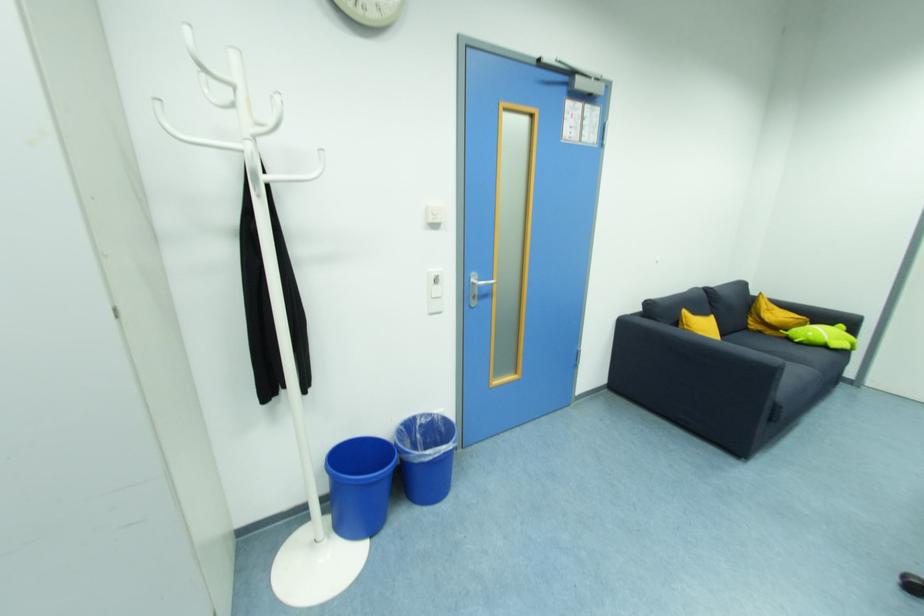
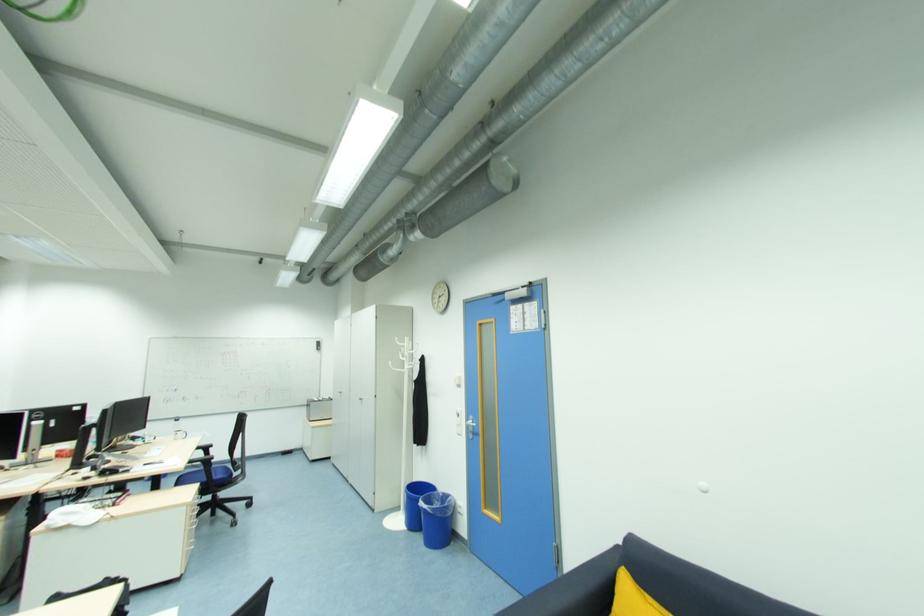
In the second image, find the point that corresponds to (477,297) in the first image.

(473, 432)